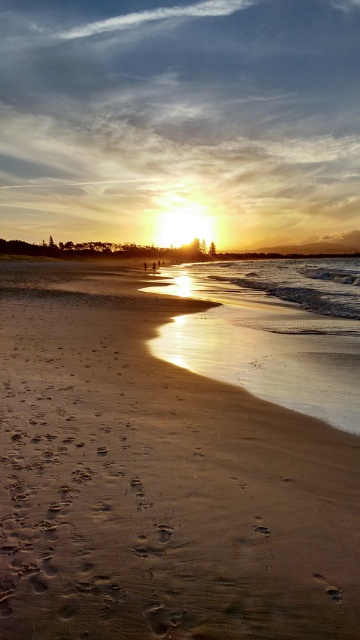
You are standing at the center of the beach scene. There is a sandy beach at lower left located at point (156, 481). If you want to walk directly towards the sandy beach at lower left, in which direction should you move?

You should move towards the lower left direction to reach the sandy beach at lower left located at point (156, 481).

You are standing at the beach looking towards the sunset. There are two points marked on the sand. The first point is at coordinates point (6, 300) and the second is at point (270, 275). Which point is closer to you?

Point (6, 300) is closer to the viewer than point (270, 275).